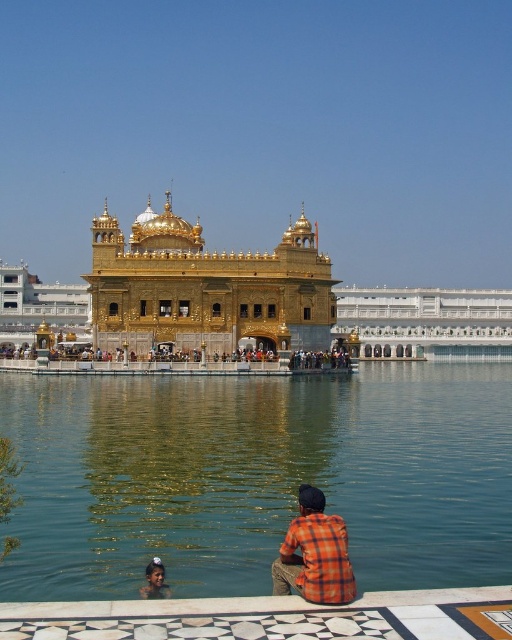
Question: Which of the following is the closest to the observer?

Choices:
 (A) (283, 570)
 (B) (150, 566)
 (C) (240, 269)

Answer: (A)

Question: Can you confirm if clear blue water at center is wider than orange plaid shirt at lower center?

Choices:
 (A) no
 (B) yes

Answer: (B)

Question: Estimate the real-world distances between objects in this image. Which object is closer to the clear blue water at center?

Choices:
 (A) orange checkered shirt at lower center
 (B) orange plaid shirt at lower center

Answer: (B)

Question: Can you confirm if orange plaid shirt at lower center is bigger than orange checkered shirt at lower center?

Choices:
 (A) no
 (B) yes

Answer: (B)

Question: Which object appears farthest from the camera in this image?

Choices:
 (A) orange plaid shirt at lower center
 (B) gold/golden dome at center
 (C) clear blue water at center

Answer: (B)

Question: Can you confirm if orange plaid shirt at lower center is positioned above orange checkered shirt at lower center?

Choices:
 (A) yes
 (B) no

Answer: (A)